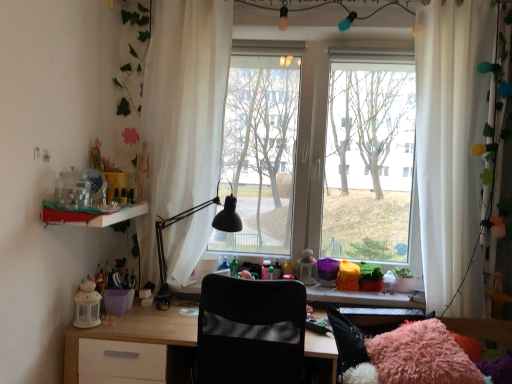
Question: Is white sheer curtain at right, the 2th curtain when ordered from left to right, surrounded by matte plastic shelf at left?

Choices:
 (A) no
 (B) yes

Answer: (A)

Question: Is matte plastic shelf at left thinner than white sheer curtain at right, the 2th curtain when ordered from left to right?

Choices:
 (A) yes
 (B) no

Answer: (B)

Question: From the image's perspective, is matte plastic shelf at left under white sheer curtain at right, the 1th curtain from the right?

Choices:
 (A) yes
 (B) no

Answer: (A)

Question: Is matte plastic shelf at left facing away from white sheer curtain at right, the 1th curtain from the right?

Choices:
 (A) yes
 (B) no

Answer: (B)

Question: Does matte plastic shelf at left have a greater height compared to white sheer curtain at right, the 1th curtain from the right?

Choices:
 (A) no
 (B) yes

Answer: (A)

Question: Based on their positions, is transparent glass window at center located to the left or right of black mesh chair at center?

Choices:
 (A) left
 (B) right

Answer: (B)

Question: From the image's perspective, is transparent glass window at center above or below black mesh chair at center?

Choices:
 (A) below
 (B) above

Answer: (B)

Question: Is transparent glass window at center taller or shorter than black mesh chair at center?

Choices:
 (A) tall
 (B) short

Answer: (A)

Question: Is transparent glass window at center inside or outside of black mesh chair at center?

Choices:
 (A) inside
 (B) outside

Answer: (B)

Question: Considering the relative positions of light wood desk at center and transparent glass window at center in the image provided, is light wood desk at center to the left or to the right of transparent glass window at center?

Choices:
 (A) right
 (B) left

Answer: (B)

Question: From the image's perspective, relative to transparent glass window at center, is light wood desk at center above or below?

Choices:
 (A) above
 (B) below

Answer: (B)

Question: Is light wood desk at center situated inside transparent glass window at center or outside?

Choices:
 (A) outside
 (B) inside

Answer: (A)

Question: Is point (135, 337) positioned closer to the camera than point (340, 142)?

Choices:
 (A) farther
 (B) closer

Answer: (B)

Question: From the image's perspective, is black matte desk lamp at center above or below white sheer curtain at center, acting as the second curtain starting from the right?

Choices:
 (A) above
 (B) below

Answer: (B)

Question: From a real-world perspective, is black matte desk lamp at center physically located above or below white sheer curtain at center, acting as the second curtain starting from the right?

Choices:
 (A) below
 (B) above

Answer: (A)